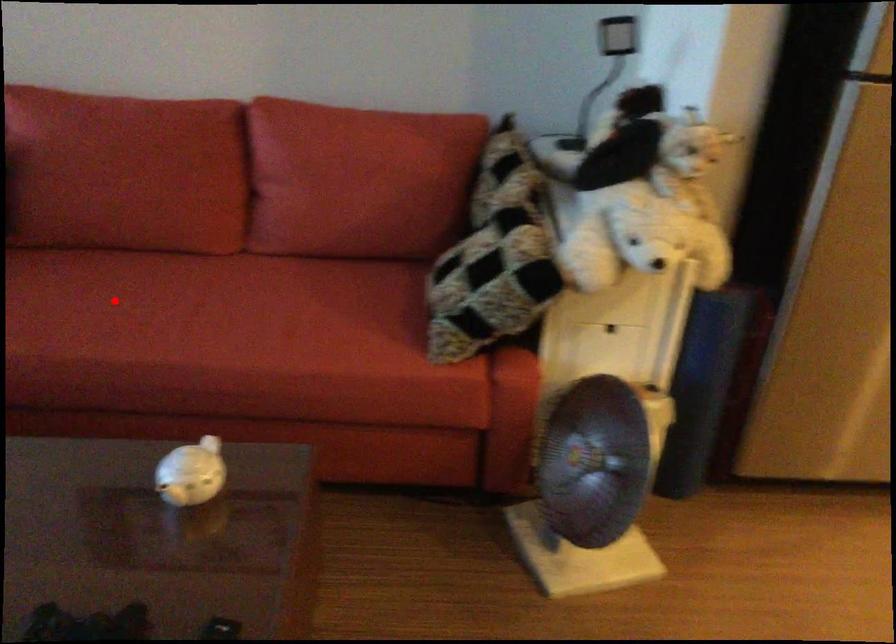
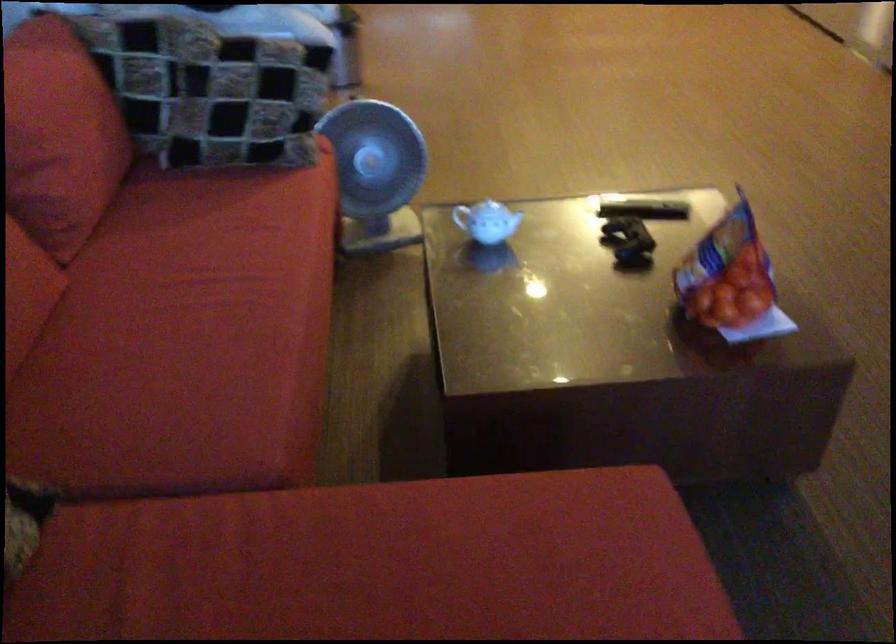
Question: A red point is marked in image1. In image2, is the corresponding 3D point closer to the camera or farther? Reply with the corresponding letter.

Choices:
 (A) The corresponding 3D point is closer.
 (B) The corresponding 3D point is farther.

Answer: (A)